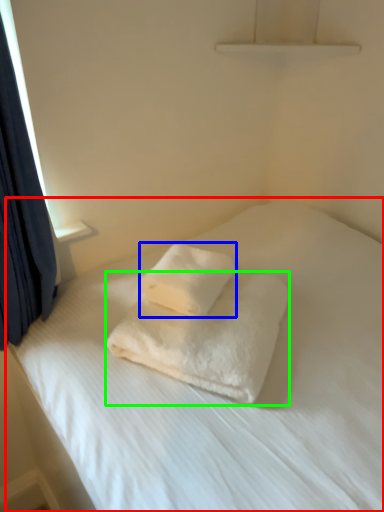
Question: Estimate the real-world distances between objects in this image. Which object is farther from bed (highlighted by a red box), towel (highlighted by a blue box) or towel (highlighted by a green box)?

Choices:
 (A) towel
 (B) towel

Answer: (A)